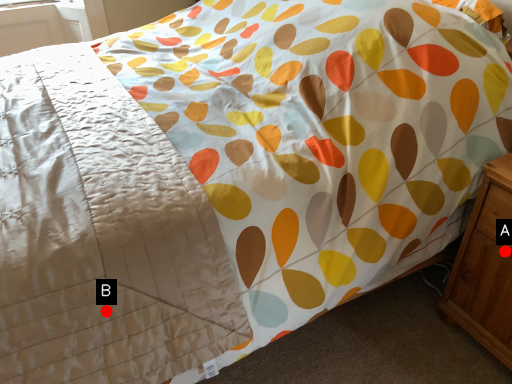
Question: Two points are circled on the image, labeled by A and B beside each circle. Which of the following is the closest to the observer?

Choices:
 (A) A is closer
 (B) B is closer

Answer: (B)